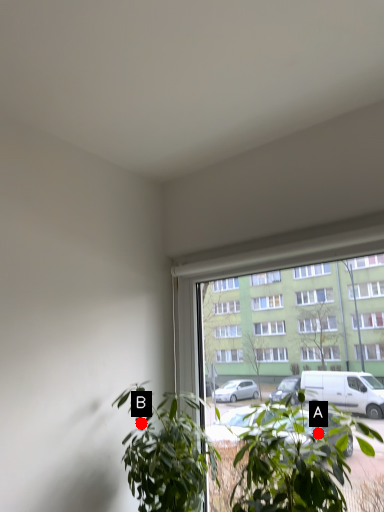
Question: Two points are circled on the image, labeled by A and B beside each circle. Which point is further to the camera?

Choices:
 (A) A is further
 (B) B is further

Answer: (B)